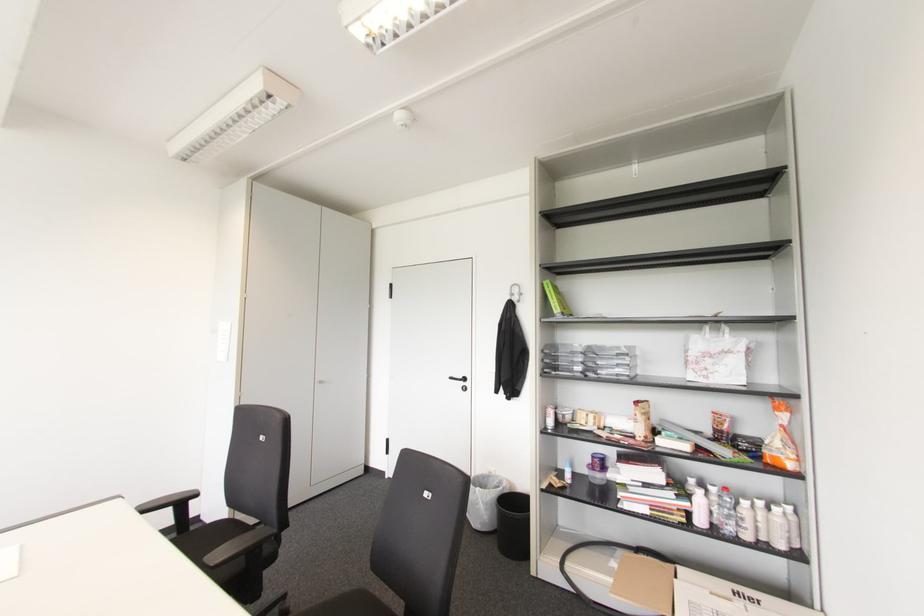
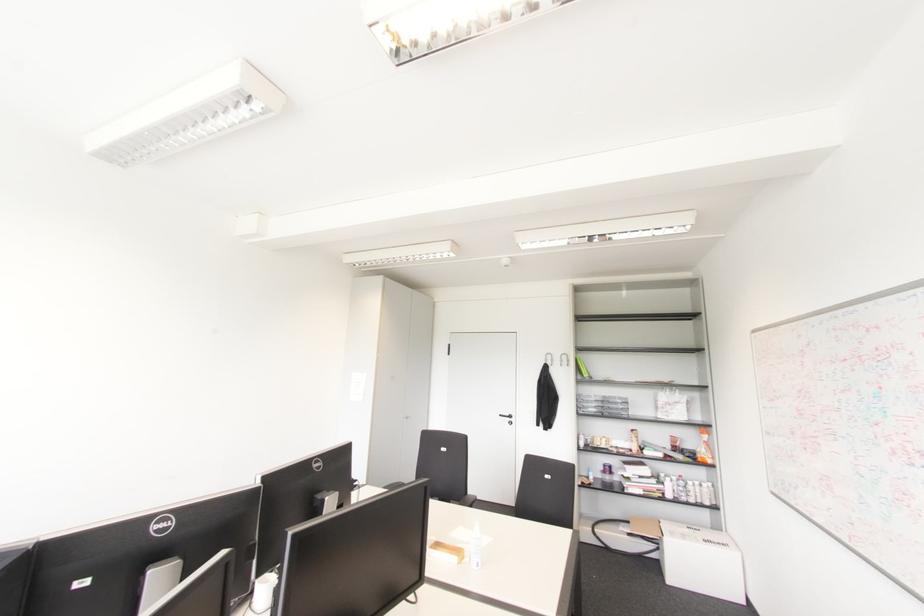
Which direction would the cameraman need to move to produce the second image?

The cameraman moved toward left, backward.